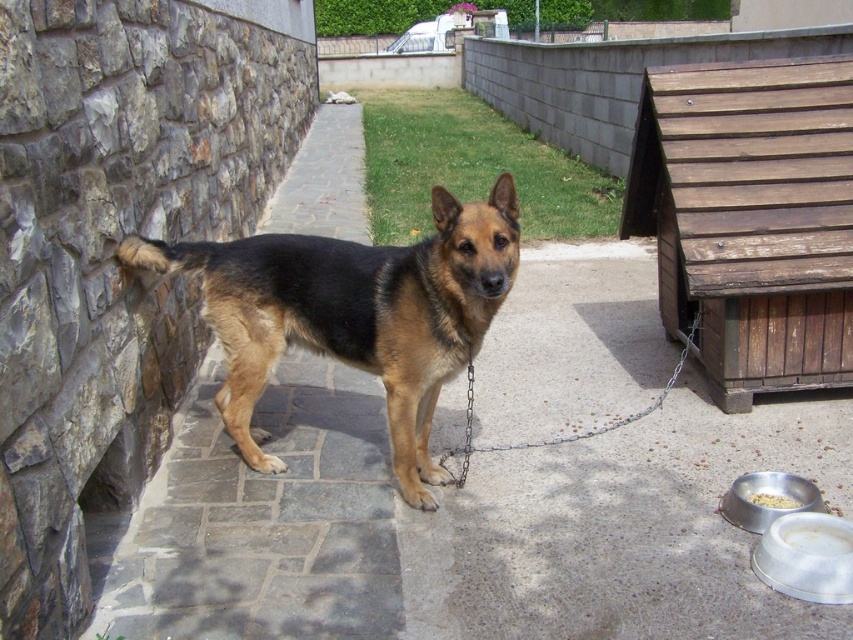
Who is shorter, brown stone pavement at center or black and tan fur dog at center?

black and tan fur dog at center

Based on the photo, which is more to the left, brown stone pavement at center or black and tan fur dog at center?

From the viewer's perspective, black and tan fur dog at center appears more on the left side.

Which is in front, point (315, 432) or point (282, 339)?

Point (282, 339)

Identify the location of brown stone pavement at center. (463, 525).

Which is above, black and tan fur dog at center or white matte bowl at lower right?

black and tan fur dog at center is higher up.

Which is in front, point (312, 305) or point (747, 497)?

Point (747, 497)

This screenshot has height=640, width=853. Find the location of `black and tan fur dog at center`. black and tan fur dog at center is located at coordinates (354, 314).

Is metallic chain at center thinner than white matte bowl at lower right?

No.

Which is in front, point (456, 445) or point (756, 500)?

Positioned in front is point (756, 500).

This screenshot has height=640, width=853. Find the location of `metallic chain at center`. metallic chain at center is located at coordinates (556, 436).

What are the coordinates of `metallic chain at center` in the screenshot? It's located at (556, 436).